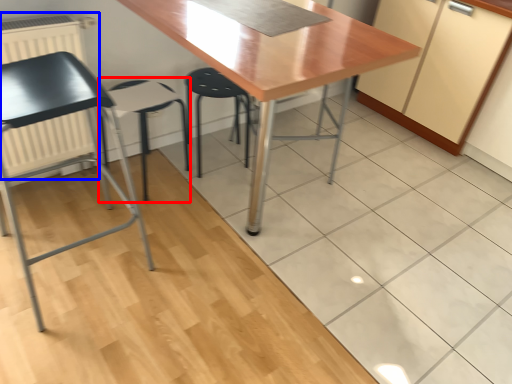
Question: Which object is further to the camera taking this photo, folding chair (highlighted by a red box) or radiator (highlighted by a blue box)?

Choices:
 (A) folding chair
 (B) radiator

Answer: (A)